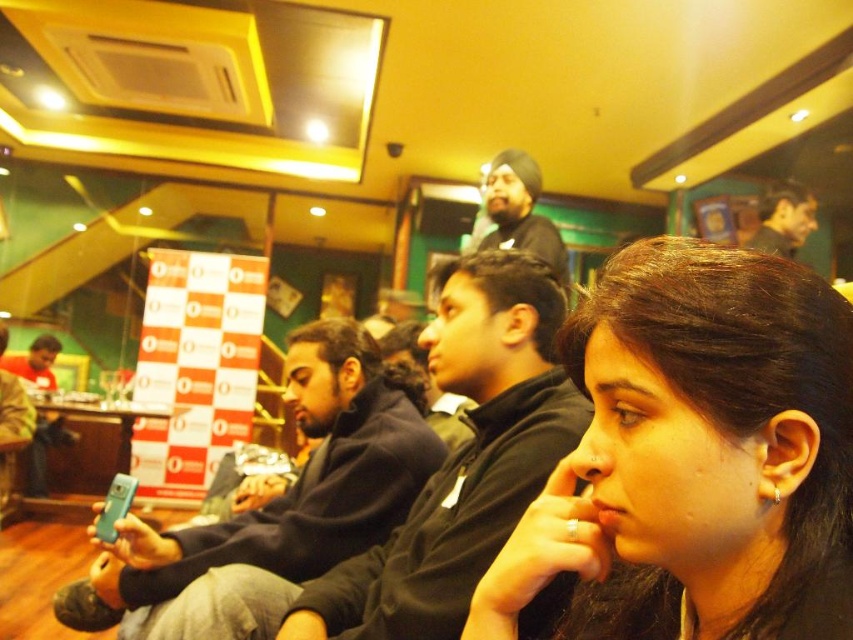
You are a photographer taking a group photo of the dark brown hair at center and dark blue sweater at center. The minimum distance required between subjects for clear focus is 20 inches. Can you take the photo without adjusting their positions?

The dark brown hair at center and dark blue sweater at center are 18.22 inches apart from each other, which is less than the required 20 inches. Therefore, you cannot take the photo without adjusting their positions to increase the distance between them.